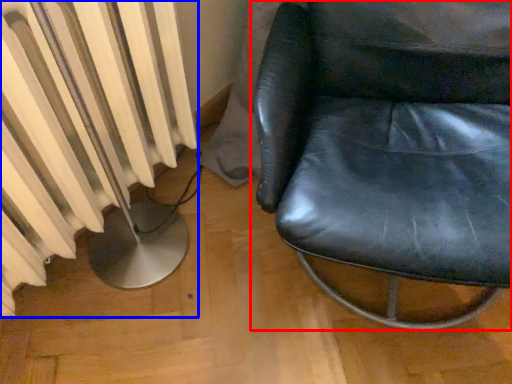
Question: Among these objects, which one is farthest to the camera, chair (highlighted by a red box) or radiator (highlighted by a blue box)?

Choices:
 (A) chair
 (B) radiator

Answer: (B)